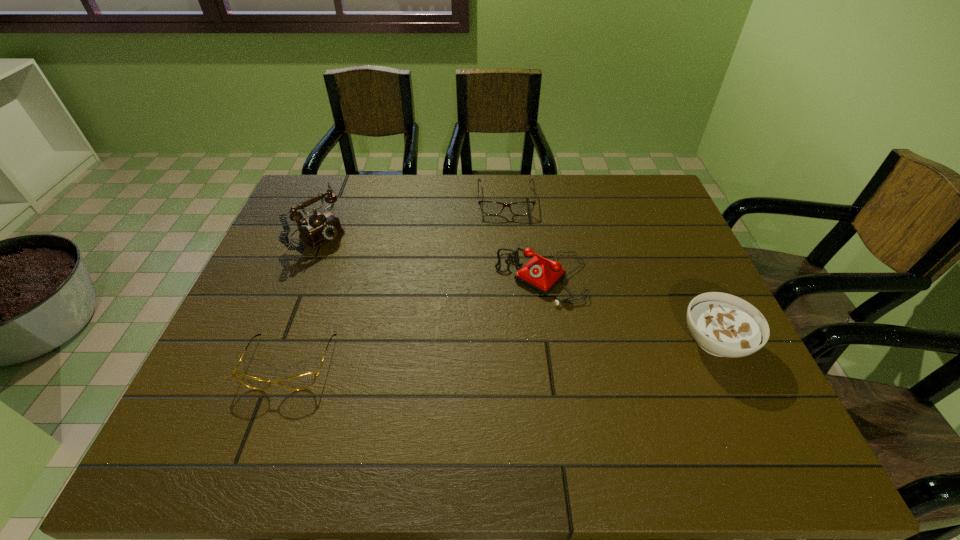
At what (x,y) coordinates should I click in order to perform the action: click on telephone that is positioned at the left edge. Please return your answer as a coordinate pair (x, y). Looking at the image, I should click on (320, 227).

You are a GUI agent. You are given a task and a screenshot of the screen. Output one action in this format:
    pyautogui.click(x=<x>, y=<y>)
    Task: Click on the object that is at the right edge
    
    Given the screenshot: What is the action you would take?
    pyautogui.click(x=724, y=325)

This screenshot has width=960, height=540. I want to click on object that is at the far left corner, so click(x=320, y=227).

I want to click on object that is at the near left corner, so click(x=302, y=381).

The image size is (960, 540). I want to click on vacant space at the far edge of the desktop, so click(x=360, y=190).

Image resolution: width=960 pixels, height=540 pixels. In the image, there is a desktop. In order to click on free space at the near edge in this screenshot , I will do `click(283, 408)`.

In the image, there is a desktop. Identify the location of free space at the right edge. This screenshot has width=960, height=540. (665, 219).

In order to click on vacant region at the far left corner of the desktop in this screenshot , I will do `click(308, 211)`.

You are a GUI agent. You are given a task and a screenshot of the screen. Output one action in this format:
    pyautogui.click(x=<x>, y=<y>)
    Task: Click on the vacant point at the near left corner
    The image size is (960, 540).
    Given the screenshot: What is the action you would take?
    pyautogui.click(x=246, y=396)

This screenshot has width=960, height=540. In order to click on vacant space at the far right corner of the desktop in this screenshot , I will do `click(626, 187)`.